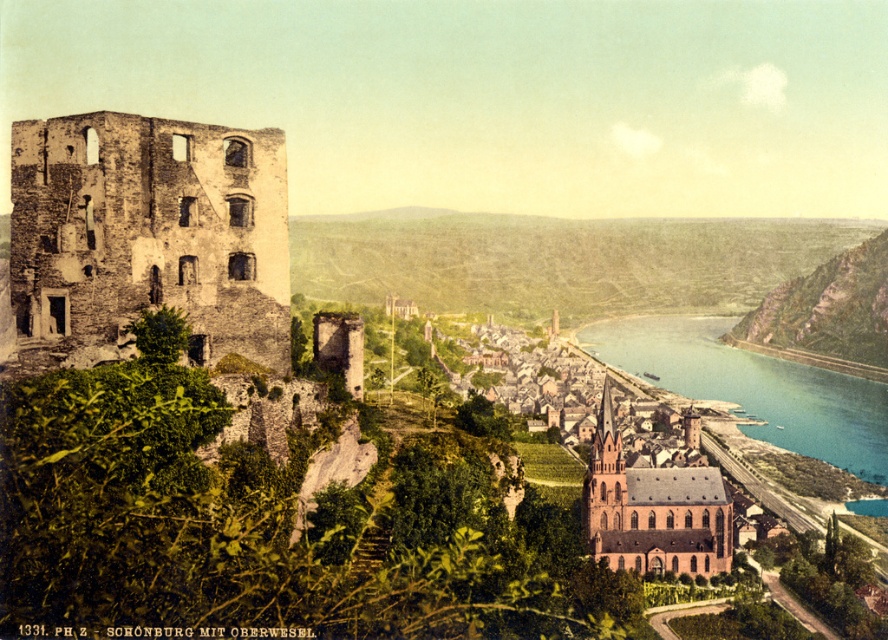
Question: Is blue water at river right positioned at the back of brown stone church at center?

Choices:
 (A) yes
 (B) no

Answer: (A)

Question: Among these objects, which one is nearest to the camera?

Choices:
 (A) blue water at river right
 (B) brown stone church at center

Answer: (B)

Question: Is blue water at river right smaller than brown stone church at center?

Choices:
 (A) yes
 (B) no

Answer: (B)

Question: Does blue water at river right appear under brown stone church at center?

Choices:
 (A) yes
 (B) no

Answer: (B)

Question: Which point is closer to the camera?

Choices:
 (A) (724, 515)
 (B) (799, 381)

Answer: (A)